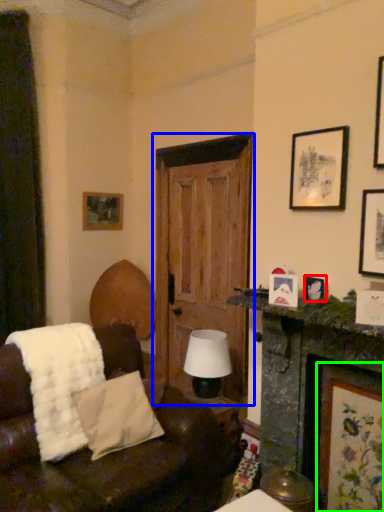
Question: Which object is the farthest from picture frame (highlighted by a red box)? Choose among these: door (highlighted by a blue box) or picture frame (highlighted by a green box).

Choices:
 (A) door
 (B) picture frame

Answer: (A)